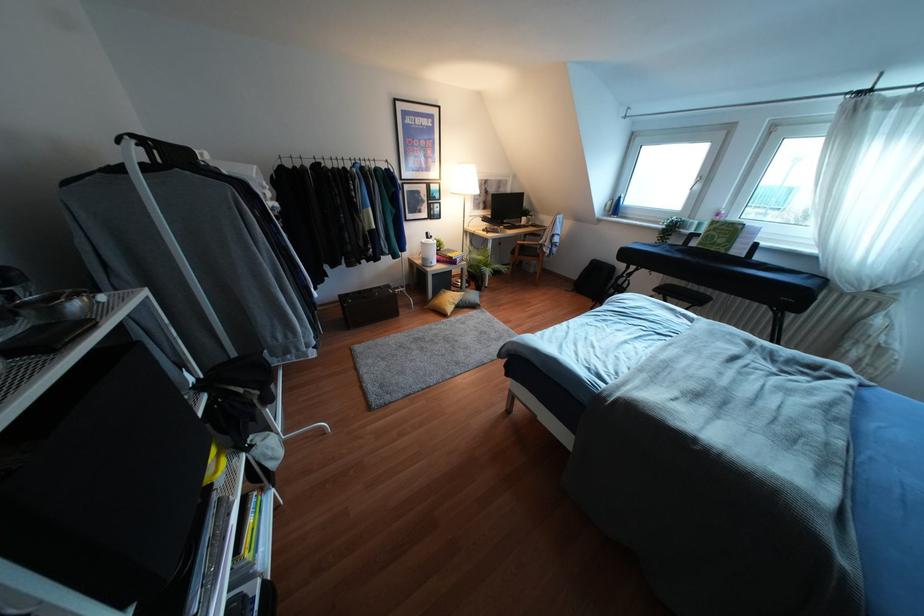
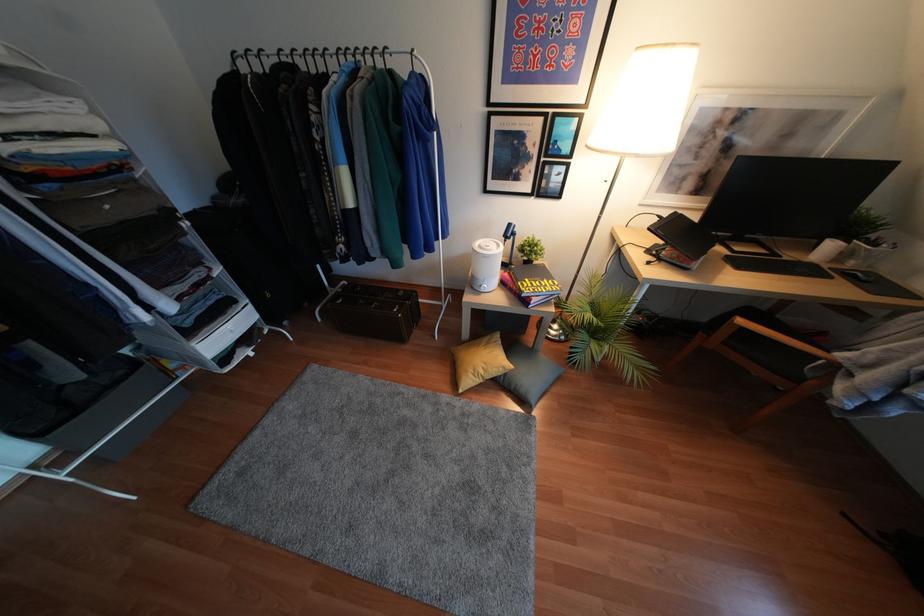
Find the pixel in the second image that matches point (483, 219) in the first image.

(666, 224)